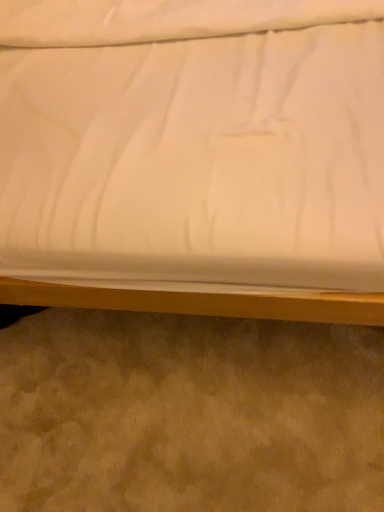
This screenshot has height=512, width=384. What do you see at coordinates (194, 157) in the screenshot? I see `white fabric bed at center` at bounding box center [194, 157].

Based on the photo, what is the approximate height of white fabric bed at center?

white fabric bed at center is 1.99 inches in height.

I want to click on white fabric bed at center, so (194, 157).

Image resolution: width=384 pixels, height=512 pixels. Identify the location of white fabric bed at center. (194, 157).